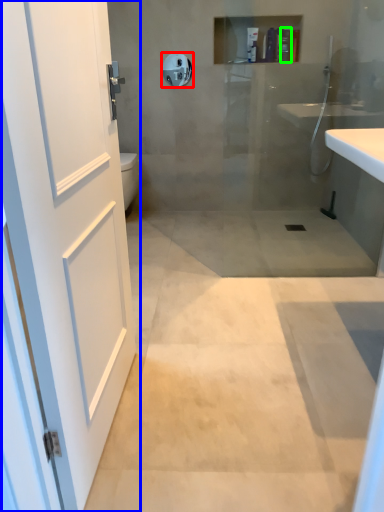
Question: Which object is positioned closest to towel bar (highlighted by a red box)? Select from door (highlighted by a blue box) and toiletry (highlighted by a green box).

Choices:
 (A) door
 (B) toiletry

Answer: (B)